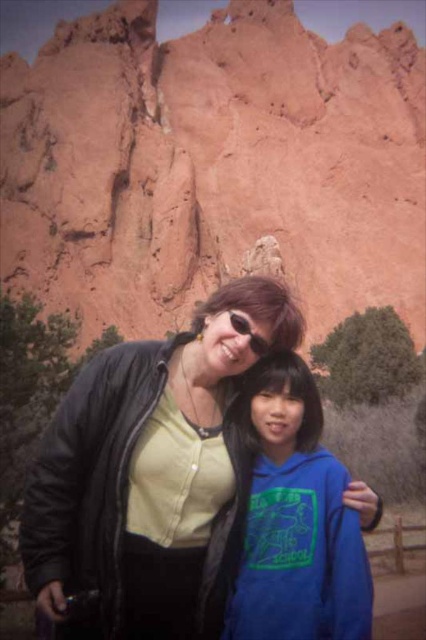
You are a photographer trying to capture a clear shot of both the black leather jacket at center and the matte black goggles at upper center. Since the camera can only focus on one object at a time, which object should you choose to ensure the larger object is in focus?

The black leather jacket at center is bigger than the matte black goggles at upper center, so you should focus on the black leather jacket at center to ensure the larger object is in focus.

Where is the black leather jacket at center located in the image?

The black leather jacket at center is located at point (149, 461) in the image.